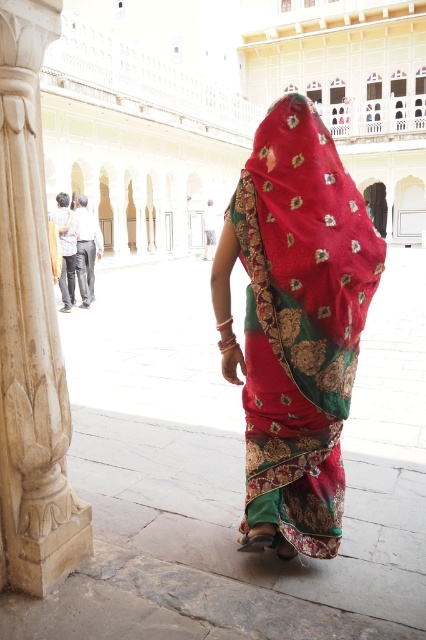
Does matte silk saree at center have a smaller size compared to matte black robe at left?

Actually, matte silk saree at center might be larger than matte black robe at left.

What do you see at coordinates (296, 324) in the screenshot? I see `matte silk saree at center` at bounding box center [296, 324].

Where is `matte silk saree at center`? matte silk saree at center is located at coordinates (296, 324).

Is white marble pillar at left to the left of matte black pants at center from the viewer's perspective?

Incorrect, white marble pillar at left is not on the left side of matte black pants at center.

Identify the location of white marble pillar at left. Image resolution: width=426 pixels, height=640 pixels. (31, 330).

Does point (0, 216) come in front of point (77, 196)?

Yes, it is in front of point (77, 196).

This screenshot has height=640, width=426. Find the location of `white marble pillar at left`. white marble pillar at left is located at coordinates (31, 330).

Does white marble pillar at left appear on the right side of matte black robe at left?

Indeed, white marble pillar at left is positioned on the right side of matte black robe at left.

Does white marble pillar at left appear under matte black robe at left?

Indeed, white marble pillar at left is positioned under matte black robe at left.

This screenshot has height=640, width=426. Find the location of `white marble pillar at left`. white marble pillar at left is located at coordinates (31, 330).

Where is `white marble pillar at left`? white marble pillar at left is located at coordinates (31, 330).